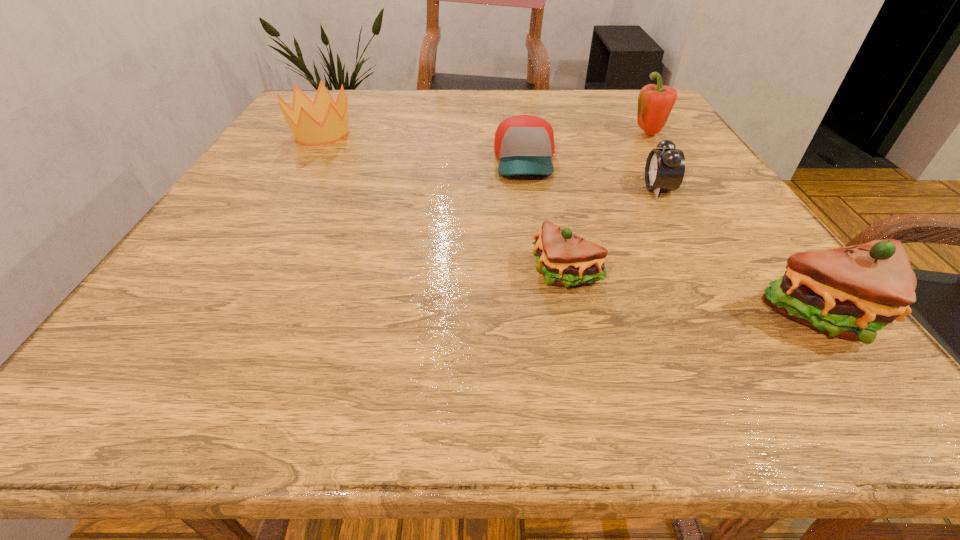
This screenshot has width=960, height=540. What are the coordinates of `object positioned at the near right corner` in the screenshot? It's located at (850, 292).

This screenshot has height=540, width=960. Find the location of `free spot at the far edge of the desktop`. free spot at the far edge of the desktop is located at coordinates (397, 108).

The width and height of the screenshot is (960, 540). Identify the location of vacant region at the near edge of the desktop. (468, 309).

Identify the location of free space at the left edge of the desktop. (296, 172).

Find the location of a particular element. The image size is (960, 540). vacant space at the right edge of the desktop is located at coordinates (708, 190).

The height and width of the screenshot is (540, 960). Identify the location of blank space at the near left corner. (243, 294).

In the image, there is a desktop. Where is `vacant space at the far right corner`? The image size is (960, 540). vacant space at the far right corner is located at coordinates (610, 95).

Identify the location of vacant space at the near right corner of the desktop. (723, 310).

The image size is (960, 540). Find the location of `vacant space in between the taller sandwich and the baseball cap`. vacant space in between the taller sandwich and the baseball cap is located at coordinates (675, 239).

Where is `vacant area between the alarm clock and the baseball cap`? vacant area between the alarm clock and the baseball cap is located at coordinates (591, 174).